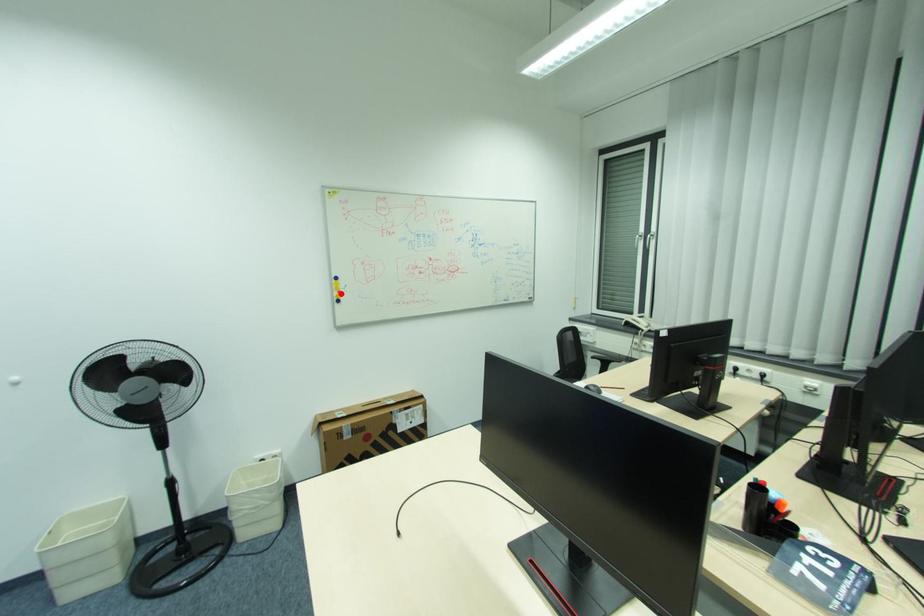
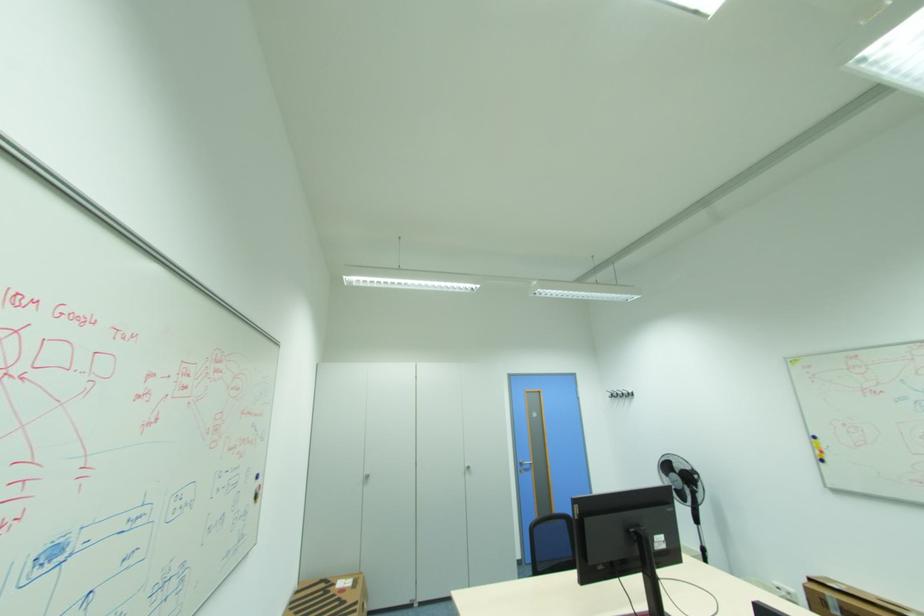
The point at the highlighted location is marked in the first image. Where is the corresponding point in the second image?

(822, 453)